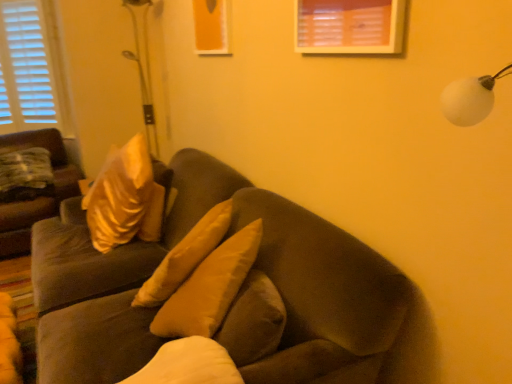
What are the coordinates of `metallic silver golf club at upper left` in the screenshot? It's located at (143, 67).

This screenshot has width=512, height=384. What do you see at coordinates (143, 67) in the screenshot?
I see `metallic silver golf club at upper left` at bounding box center [143, 67].

Where is `suede brown couch at center, acting as the 1th studio couch starting from the front`? This screenshot has width=512, height=384. suede brown couch at center, acting as the 1th studio couch starting from the front is located at coordinates (234, 300).

Describe the element at coordinates (234, 300) in the screenshot. This screenshot has height=384, width=512. I see `suede brown couch at center, acting as the second studio couch starting from the left` at that location.

Where is `metallic silver golf club at upper left`? This screenshot has height=384, width=512. metallic silver golf club at upper left is located at coordinates (143, 67).

Is satin gold pillow at left positioned with its back to suede-like brown couch at left, which is counted as the 1th studio couch, starting from the back?

Yes, satin gold pillow at left is positioned with its back facing suede-like brown couch at left, which is counted as the 1th studio couch, starting from the back.

From a real-world perspective, which object stands above the other?

From a 3D spatial view, satin gold pillow at left is above.

Does point (46, 184) come closer to viewer compared to point (17, 241)?

No, (46, 184) is further to viewer.

Is there a large distance between satin gold pillow at left and suede-like brown couch at left, which is counted as the 1th studio couch, starting from the back?

Actually, satin gold pillow at left and suede-like brown couch at left, which is counted as the 1th studio couch, starting from the back, are a little close together.

Does metallic silver golf club at upper left turn towards suede-like brown couch at left, the 2th studio couch in the right-to-left sequence?

No, metallic silver golf club at upper left does not turn towards suede-like brown couch at left, the 2th studio couch in the right-to-left sequence.

Which object is more forward, metallic silver golf club at upper left or suede-like brown couch at left, which is the second studio couch from front to back?

Positioned in front is suede-like brown couch at left, which is the second studio couch from front to back.

Is metallic silver golf club at upper left in contact with suede-like brown couch at left, which is the second studio couch from front to back?

metallic silver golf club at upper left and suede-like brown couch at left, which is the second studio couch from front to back, are clearly separated.

From the image's perspective, is metallic silver golf club at upper left beneath suede-like brown couch at left, the 2th studio couch in the right-to-left sequence?

No, from the image's perspective, metallic silver golf club at upper left is not beneath suede-like brown couch at left, the 2th studio couch in the right-to-left sequence.

From the image's perspective, is suede brown couch at center, acting as the 1th studio couch starting from the front, located above or below suede-like brown couch at left, the 2th studio couch in the right-to-left sequence?

Based on their image positions, suede brown couch at center, acting as the 1th studio couch starting from the front, is located beneath suede-like brown couch at left, the 2th studio couch in the right-to-left sequence.

Which point is more forward, (x=57, y=372) or (x=51, y=146)?

The point (x=57, y=372) is more forward.

Is suede brown couch at center, the first studio couch viewed from the right, bigger than suede-like brown couch at left, which is the first studio couch from left to right?

Correct, suede brown couch at center, the first studio couch viewed from the right, is larger in size than suede-like brown couch at left, which is the first studio couch from left to right.

Is metallic silver golf club at upper left in contact with satin gold pillow at left?

No, metallic silver golf club at upper left is not in contact with satin gold pillow at left.

I want to click on table lamp in front of the satin gold pillow at left, so click(x=143, y=67).

Can you tell me how much metallic silver golf club at upper left and satin gold pillow at left differ in facing direction?

There is a 92.1-degree angle between the facing directions of metallic silver golf club at upper left and satin gold pillow at left.

How much distance is there between metallic silver golf club at upper left and satin gold pillow at left?

A distance of 1.05 meters exists between metallic silver golf club at upper left and satin gold pillow at left.

Which of these two, suede brown couch at center, the first studio couch viewed from the right, or metallic silver golf club at upper left, stands taller?

metallic silver golf club at upper left.

I want to click on table lamp behind the suede brown couch at center, the 2th studio couch positioned from the back, so click(x=143, y=67).

Between suede brown couch at center, the 2th studio couch positioned from the back, and metallic silver golf club at upper left, which one appears on the left side from the viewer's perspective?

metallic silver golf club at upper left is more to the left.

Does metallic silver golf club at upper left contain suede brown couch at center, the 2th studio couch positioned from the back?

No, suede brown couch at center, the 2th studio couch positioned from the back, is not inside metallic silver golf club at upper left.

In terms of size, does metallic silver golf club at upper left appear bigger or smaller than suede brown couch at center, acting as the second studio couch starting from the left?

In the image, metallic silver golf club at upper left appears to be smaller than suede brown couch at center, acting as the second studio couch starting from the left.

Considering the positions of point (139, 73) and point (215, 175), is point (139, 73) closer or farther from the camera than point (215, 175)?

Point (139, 73) is positioned farther from the camera compared to point (215, 175).

Is metallic silver golf club at upper left next to suede brown couch at center, the 2th studio couch positioned from the back, and touching it?

No, metallic silver golf club at upper left is not with suede brown couch at center, the 2th studio couch positioned from the back.

From the image's perspective, relative to metallic silver golf club at upper left, is satin gold pillow at left above or below?

Clearly, from the image's perspective, satin gold pillow at left is below metallic silver golf club at upper left.

Who is shorter, satin gold pillow at left or metallic silver golf club at upper left?

Standing shorter between the two is satin gold pillow at left.

Does satin gold pillow at left have a lesser width compared to metallic silver golf club at upper left?

No, satin gold pillow at left is not thinner than metallic silver golf club at upper left.

Does satin gold pillow at left appear on the right side of metallic silver golf club at upper left?

No.

From the image's perspective, count 1st studio couchs downward from the satin gold pillow at left and point to it. Please provide its 2D coordinates.

[(39, 197)]

Find the location of `studio couch that is the 1st one when counting forward from the metallic silver golf club at upper left`. studio couch that is the 1st one when counting forward from the metallic silver golf club at upper left is located at coordinates [39, 197].

Based on their spatial positions, is metallic silver golf club at upper left or satin gold pillow at left closer to suede brown couch at center, the 2th studio couch positioned from the back?

satin gold pillow at left lies closer to suede brown couch at center, the 2th studio couch positioned from the back, than the other object.

When comparing their distances from satin gold pillow at left, does suede brown couch at center, acting as the 1th studio couch starting from the front, or suede-like brown couch at left, the 2th studio couch in the right-to-left sequence, seem further?

suede brown couch at center, acting as the 1th studio couch starting from the front.

Considering their positions, is metallic silver golf club at upper left positioned further to satin gold pillow at left than suede brown couch at center, acting as the second studio couch starting from the left?

suede brown couch at center, acting as the second studio couch starting from the left, lies further to satin gold pillow at left than the other object.

From the image, which object appears to be farther from satin gold pillow at left, suede-like brown couch at left, which is the second studio couch from front to back, or metallic silver golf club at upper left?

metallic silver golf club at upper left is positioned further to the anchor satin gold pillow at left.

Based on their spatial positions, is satin gold pillow at left or metallic silver golf club at upper left further from suede brown couch at center, the 2th studio couch positioned from the back?

metallic silver golf club at upper left.

Which object lies nearer to the anchor point metallic silver golf club at upper left, suede-like brown couch at left, which is counted as the 1th studio couch, starting from the back, or suede brown couch at center, acting as the second studio couch starting from the left?

Among the two, suede-like brown couch at left, which is counted as the 1th studio couch, starting from the back, is located nearer to metallic silver golf club at upper left.

From the image, which object appears to be nearer to suede-like brown couch at left, which is the second studio couch from front to back, metallic silver golf club at upper left or suede brown couch at center, acting as the second studio couch starting from the left?

metallic silver golf club at upper left.

Looking at this image, considering their positions, is satin gold pillow at left positioned further to metallic silver golf club at upper left than suede brown couch at center, acting as the 1th studio couch starting from the front?

Among the two, suede brown couch at center, acting as the 1th studio couch starting from the front, is located further to metallic silver golf club at upper left.

This screenshot has width=512, height=384. Identify the location of studio couch located between suede brown couch at center, the first studio couch viewed from the right, and satin gold pillow at left in the depth direction. (39, 197).

Find the location of `studio couch between suede brown couch at center, the 2th studio couch positioned from the back, and metallic silver golf club at upper left, along the z-axis`. studio couch between suede brown couch at center, the 2th studio couch positioned from the back, and metallic silver golf club at upper left, along the z-axis is located at coordinates (39, 197).

This screenshot has height=384, width=512. Find the location of `table lamp positioned between suede brown couch at center, the 2th studio couch positioned from the back, and satin gold pillow at left from near to far`. table lamp positioned between suede brown couch at center, the 2th studio couch positioned from the back, and satin gold pillow at left from near to far is located at coordinates (143, 67).

Where is `pillow between suede-like brown couch at left, which is the second studio couch from front to back, and metallic silver golf club at upper left`? The image size is (512, 384). pillow between suede-like brown couch at left, which is the second studio couch from front to back, and metallic silver golf club at upper left is located at coordinates (25, 169).